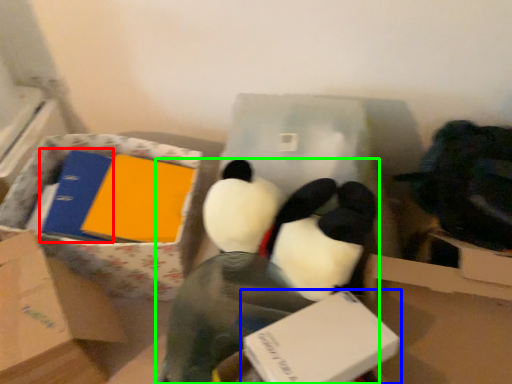
Question: Based on their relative distances, which object is farther from binder (highlighted by a red box)? Choose from box (highlighted by a blue box) and toy (highlighted by a green box).

Choices:
 (A) box
 (B) toy

Answer: (A)